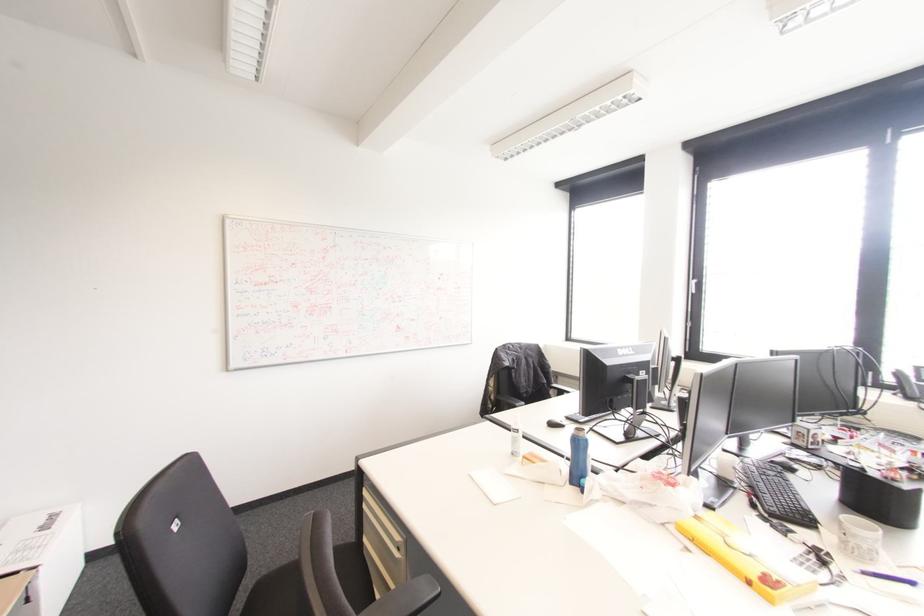
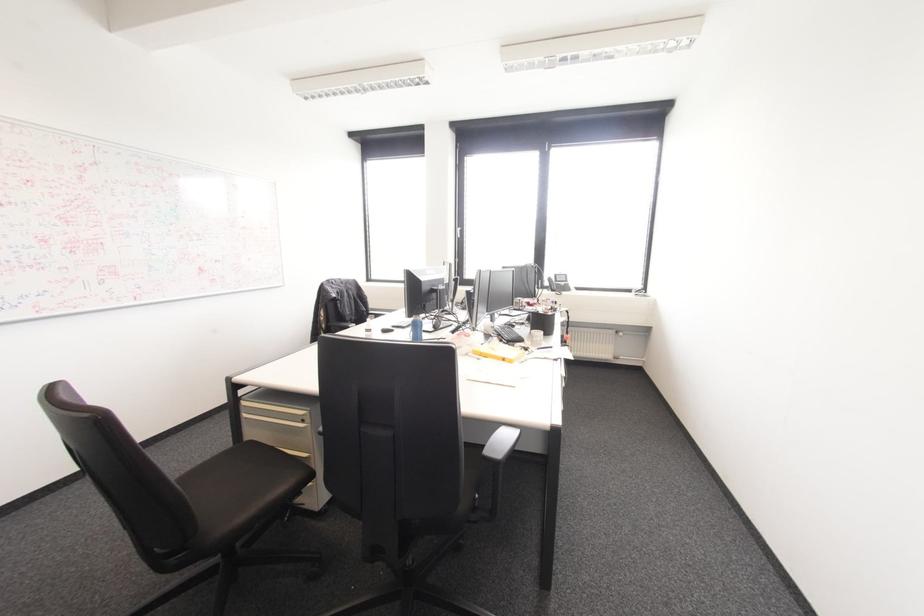
Locate, in the second image, the point that corresponds to the point at 397,548 in the first image.

(302, 419)